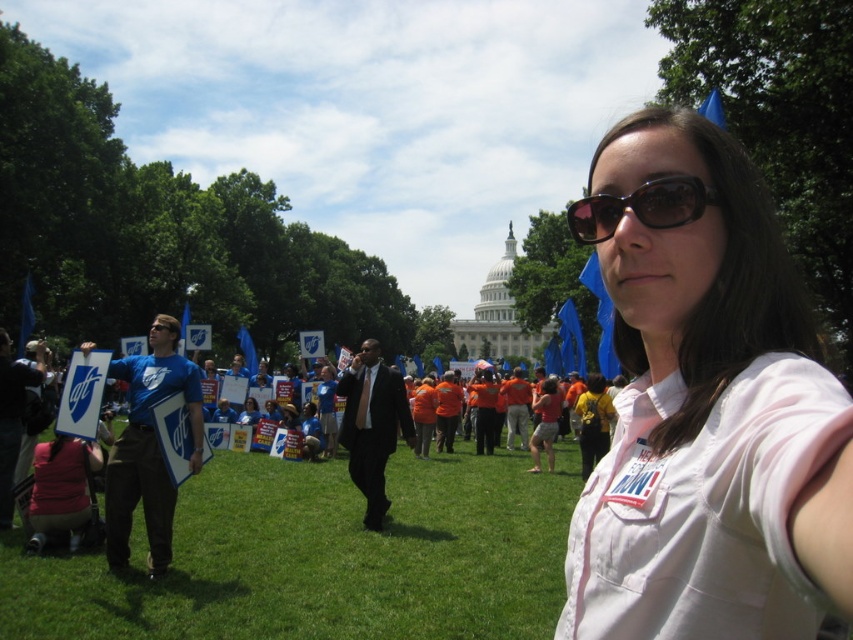
Question: Is white matte shirt at center wider than black plastic sunglasses at upper center?

Choices:
 (A) yes
 (B) no

Answer: (A)

Question: Does white matte shirt at center appear under green grass at lower center?

Choices:
 (A) yes
 (B) no

Answer: (B)

Question: Estimate the real-world distances between objects in this image. Which object is closer to the green grass at lower center?

Choices:
 (A) black plastic sunglasses at upper center
 (B) white matte shirt at center

Answer: (B)

Question: Which object is positioned farthest from the green grass at lower center?

Choices:
 (A) white matte shirt at center
 (B) black plastic sunglasses at upper center

Answer: (B)

Question: Which is farther from the green grass at lower center?

Choices:
 (A) black plastic sunglasses at upper center
 (B) white matte shirt at center

Answer: (A)

Question: Is white matte shirt at center closer to camera compared to black plastic sunglasses at upper center?

Choices:
 (A) yes
 (B) no

Answer: (A)